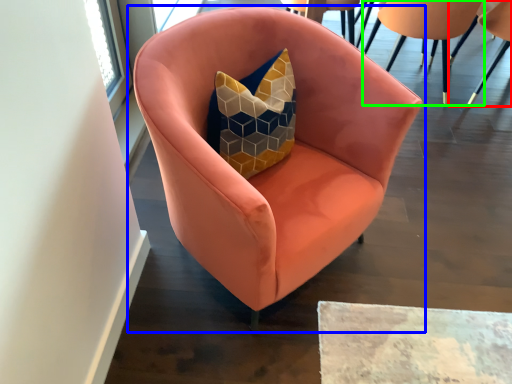
Question: Which is nearer to the chair (highlighted by a red box)? chair (highlighted by a blue box) or chair (highlighted by a green box).

Choices:
 (A) chair
 (B) chair

Answer: (B)